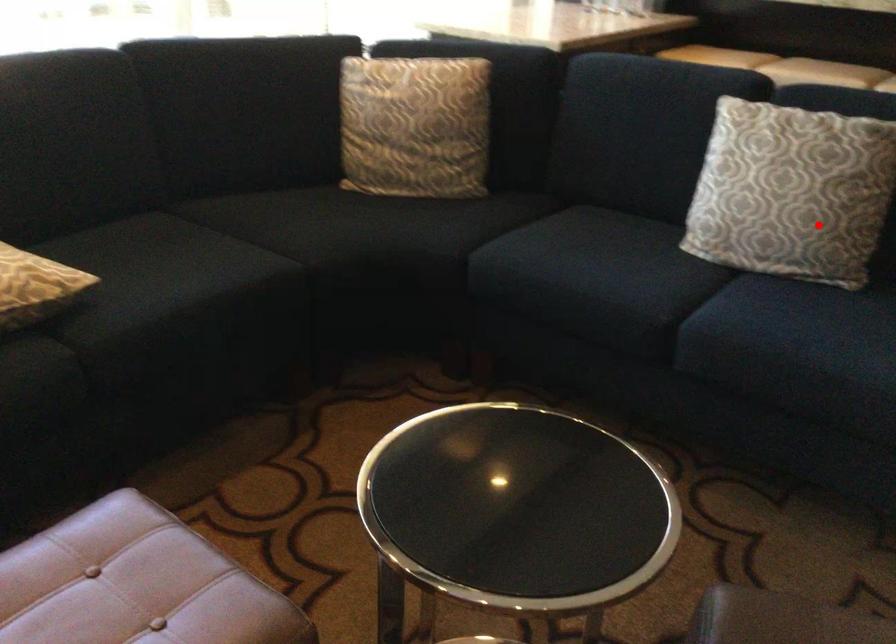
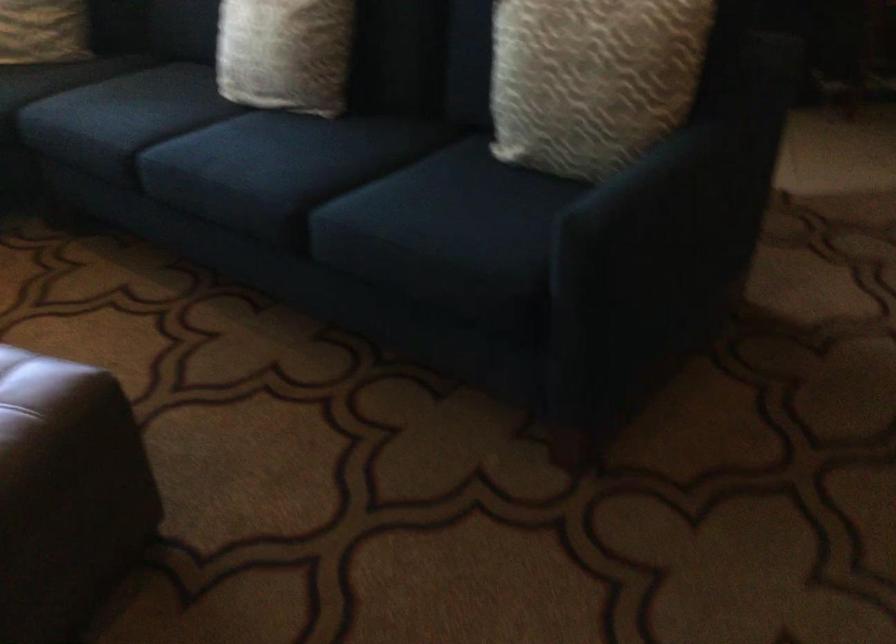
The point at the highlighted location is marked in the first image. Where is the corresponding point in the second image?

(285, 53)